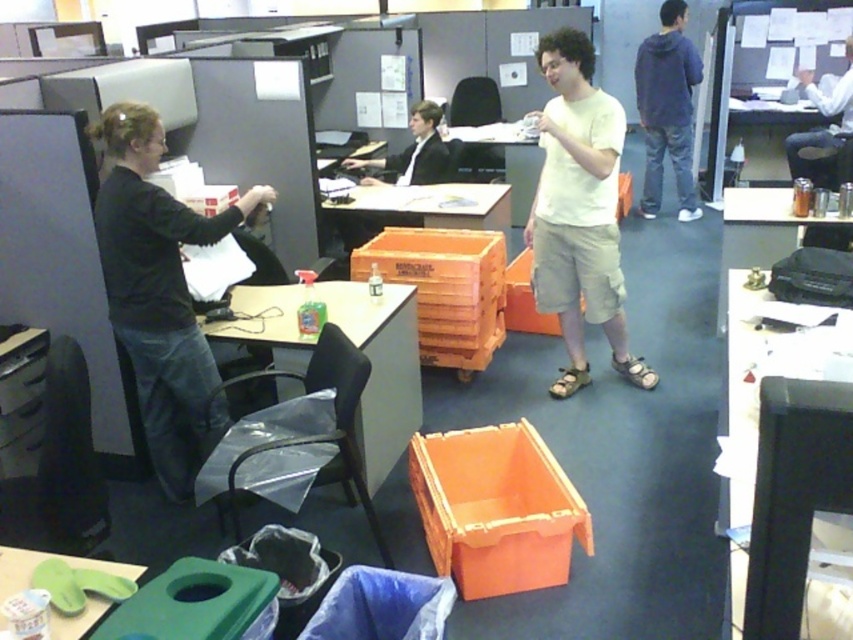
Question: Which object is farther from the camera taking this photo?

Choices:
 (A) white cotton t-shirt at center
 (B) black matte shirt at upper left
 (C) translucent plastic table at center

Answer: (A)

Question: Does blue hoodie at upper right have a larger size compared to matte plastic table at center?

Choices:
 (A) yes
 (B) no

Answer: (A)

Question: Can you confirm if black matte shirt at upper left is positioned above blue hoodie at upper right?

Choices:
 (A) no
 (B) yes

Answer: (A)

Question: Among these objects, which one is farthest from the camera?

Choices:
 (A) black matte shirt at upper left
 (B) matte plastic table at center
 (C) formal suit at center

Answer: (B)

Question: Which object appears farthest from the camera in this image?

Choices:
 (A) orange plastic crate at center
 (B) matte plastic table at center
 (C) formal suit at center

Answer: (B)

Question: Can you confirm if matte plastic table at center is positioned above green plastic table at lower left?

Choices:
 (A) yes
 (B) no

Answer: (A)